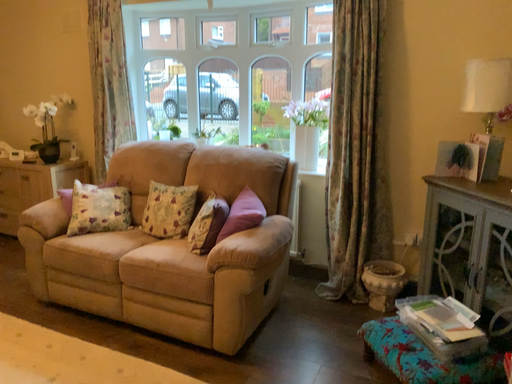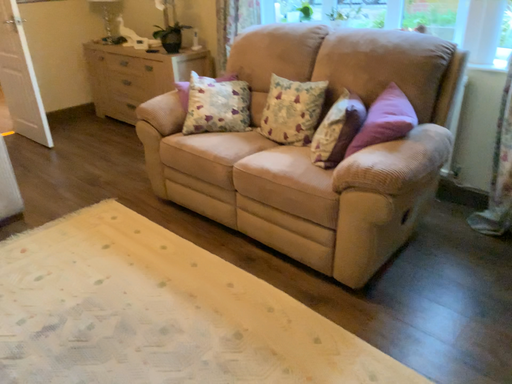
Question: How did the camera likely rotate when shooting the video?

Choices:
 (A) rotated right
 (B) rotated left

Answer: (B)